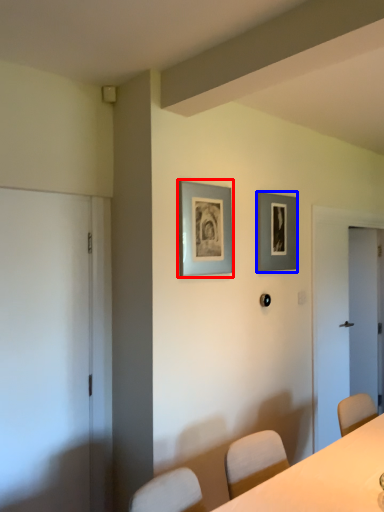
Question: Which object appears farthest to the camera in this image, picture frame (highlighted by a red box) or picture frame (highlighted by a blue box)?

Choices:
 (A) picture frame
 (B) picture frame

Answer: (B)